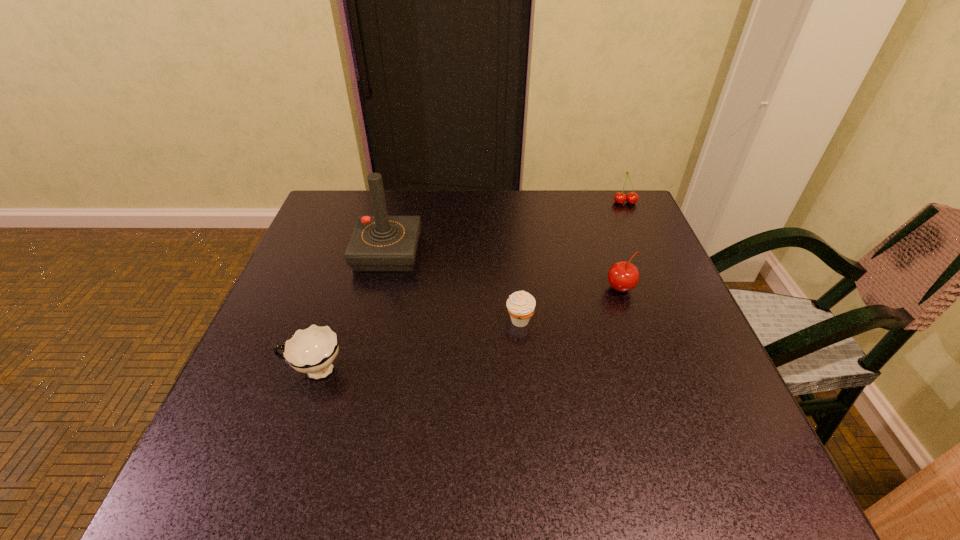
Locate an element on the screen. vacant space at the far edge of the desktop is located at coordinates (x=511, y=225).

Image resolution: width=960 pixels, height=540 pixels. What are the coordinates of `free location at the near edge` in the screenshot? It's located at (473, 443).

Locate an element on the screen. free region at the left edge of the desktop is located at coordinates (300, 291).

The height and width of the screenshot is (540, 960). I want to click on free space at the right edge, so click(686, 339).

Identify the location of free space at the far left corner of the desktop. (317, 235).

In the image, there is a desktop. Find the location of `vacant region at the far right corner`. vacant region at the far right corner is located at coordinates (611, 212).

Image resolution: width=960 pixels, height=540 pixels. In order to click on free space between the fourth farthest object and the joystick in this screenshot , I will do `click(453, 287)`.

This screenshot has height=540, width=960. Identify the location of vacant area that lies between the left cherry and the tallest object. (504, 271).

Find the location of a particular element. The image size is (960, 540). vacant area between the second object from right to left and the farther cherry is located at coordinates (623, 245).

This screenshot has width=960, height=540. Identify the location of vacant region between the third farthest object and the second nearest object. (570, 305).